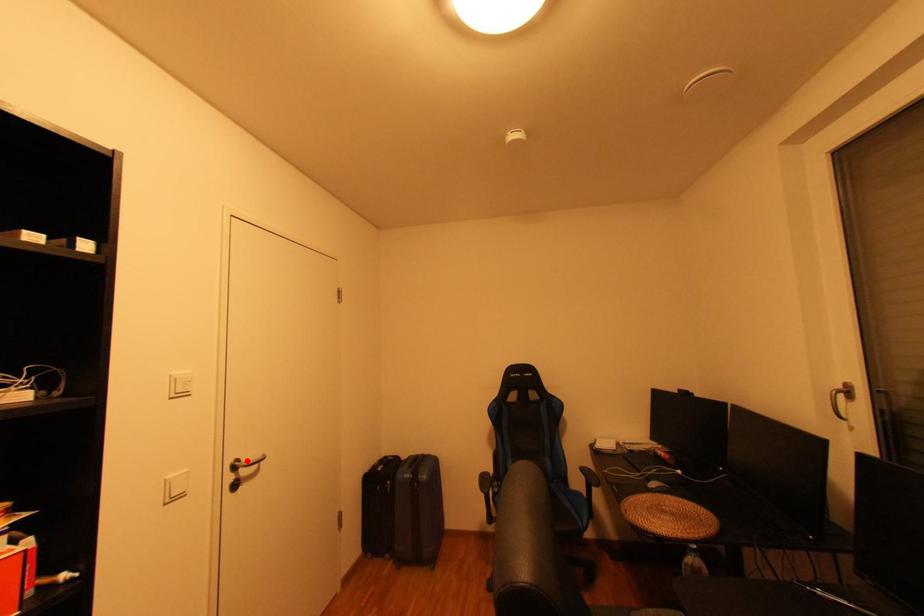
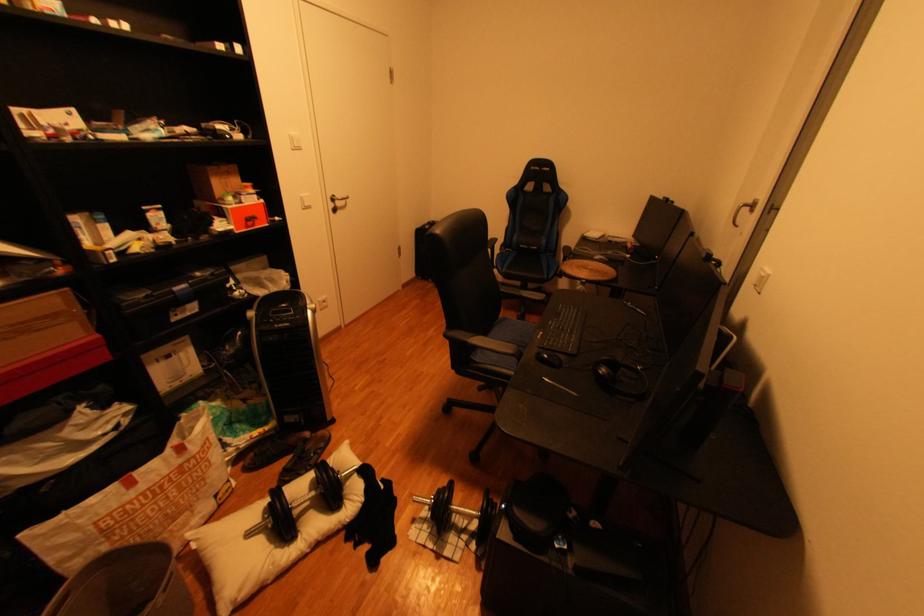
Find the pixel in the second image that matches the highlighted location in the first image.

(345, 197)